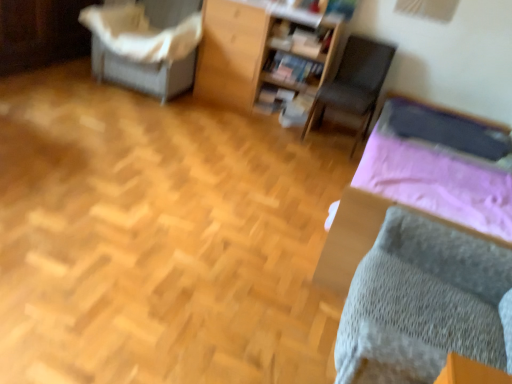
Question: Is the depth of gray knitted bed at lower right less than that of white fabric-covered chair at upper left, which is counted as the first furniture, starting from the left?

Choices:
 (A) yes
 (B) no

Answer: (A)

Question: Could you tell me if gray knitted bed at lower right is turned towards white fabric-covered chair at upper left, the 2th furniture in the right-to-left sequence?

Choices:
 (A) yes
 (B) no

Answer: (B)

Question: Are gray knitted bed at lower right and white fabric-covered chair at upper left, which is counted as the first furniture, starting from the left, located far from each other?

Choices:
 (A) yes
 (B) no

Answer: (A)

Question: From a real-world perspective, is gray knitted bed at lower right on white fabric-covered chair at upper left, which is counted as the first furniture, starting from the left?

Choices:
 (A) yes
 (B) no

Answer: (B)

Question: Is gray knitted bed at lower right thinner than white fabric-covered chair at upper left, the 2th furniture in the right-to-left sequence?

Choices:
 (A) no
 (B) yes

Answer: (A)

Question: Is matte wooden bookshelf at center wider or thinner than gray knitted bed at lower right?

Choices:
 (A) thin
 (B) wide

Answer: (A)

Question: Considering the positions of matte wooden bookshelf at center and gray knitted bed at lower right in the image, is matte wooden bookshelf at center taller or shorter than gray knitted bed at lower right?

Choices:
 (A) tall
 (B) short

Answer: (B)

Question: Is matte wooden bookshelf at center in front of or behind gray knitted bed at lower right in the image?

Choices:
 (A) front
 (B) behind

Answer: (B)

Question: Is matte wooden bookshelf at center spatially inside gray knitted bed at lower right, or outside of it?

Choices:
 (A) outside
 (B) inside

Answer: (A)

Question: Based on their sizes in the image, would you say wooden bookshelf at upper center, arranged as the second furniture when viewed from the left, is bigger or smaller than gray knitted bed at lower right?

Choices:
 (A) small
 (B) big

Answer: (A)

Question: Is point (243, 11) positioned closer to the camera than point (346, 206)?

Choices:
 (A) farther
 (B) closer

Answer: (A)

Question: In the image, is wooden bookshelf at upper center, arranged as the second furniture when viewed from the left, on the left side or the right side of gray knitted bed at lower right?

Choices:
 (A) right
 (B) left

Answer: (B)

Question: From a real-world perspective, is wooden bookshelf at upper center, the 1th furniture from the right, physically located above or below gray knitted bed at lower right?

Choices:
 (A) above
 (B) below

Answer: (A)

Question: Is wooden bookshelf at upper center, the 1th furniture from the right, taller or shorter than white fabric-covered chair at upper left, which is counted as the first furniture, starting from the left?

Choices:
 (A) tall
 (B) short

Answer: (A)

Question: From a real-world perspective, is wooden bookshelf at upper center, the 1th furniture from the right, positioned above or below white fabric-covered chair at upper left, which is counted as the first furniture, starting from the left?

Choices:
 (A) above
 (B) below

Answer: (A)